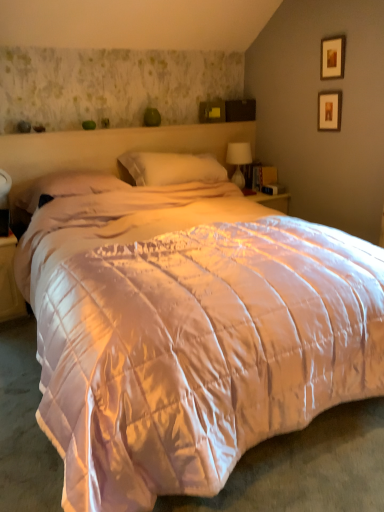
Question: Looking at the image, does translucent glass table lamp at upper right seem bigger or smaller compared to wooden picture frame at upper right, placed as the second picture frame when sorted from bottom to top?

Choices:
 (A) big
 (B) small

Answer: (A)

Question: Is point (243, 143) positioned closer to the camera than point (327, 53)?

Choices:
 (A) closer
 (B) farther

Answer: (B)

Question: Which object is positioned farthest from the wooden picture frame at upper right, arranged as the second picture frame when viewed from the top?

Choices:
 (A) matte white nightstand at lower left
 (B) pink satin pillow at center, which is counted as the 1th pillow, starting from the left
 (C) white soft pillow at center, positioned as the 2th pillow in left-to-right order
 (D) wooden picture frame at upper right, placed as the second picture frame when sorted from bottom to top
 (E) translucent glass table lamp at upper right

Answer: (A)

Question: Estimate the real-world distances between objects in this image. Which object is farther from the matte white nightstand at lower left?

Choices:
 (A) white soft pillow at center, positioned as the 2th pillow in left-to-right order
 (B) wooden picture frame at upper right, which appears as the 1th picture frame when viewed from the top
 (C) translucent glass table lamp at upper right
 (D) pink satin pillow at center, the second pillow viewed from the right
 (E) wooden picture frame at upper right, acting as the first picture frame starting from the bottom

Answer: (B)